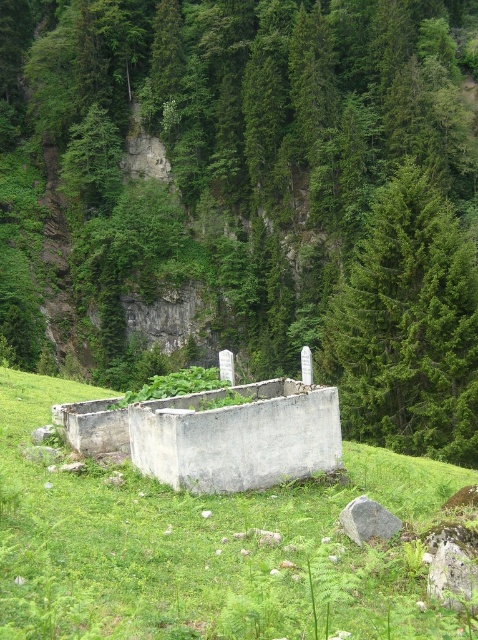
You are a hiker who wants to take a photo of the green grassy at center and the green leafy tree at center. Which object should you focus on first if you want both to be in clear focus?

The green grassy at center is behind the green leafy tree at center, so you should focus on the green leafy tree at center first to ensure both are in clear focus.

You are standing at the viewpoint overlooking the serene natural setting with the rectangular concrete structure at the center. You want to place a flag at point (349, 369). Considering the distance from where you are standing, will the flag be visible to someone standing at the viewpoint?

The distance between point (349, 369) and the viewer is 45.01 meters. Since the flag is placed at that point, someone standing at the viewpoint would be able to see it as it is within a visible range.

You are standing at the point marked as point (205, 545) in the image. What do you see directly beneath your feet?

You see green grassy at center directly beneath your feet at point (205, 545).